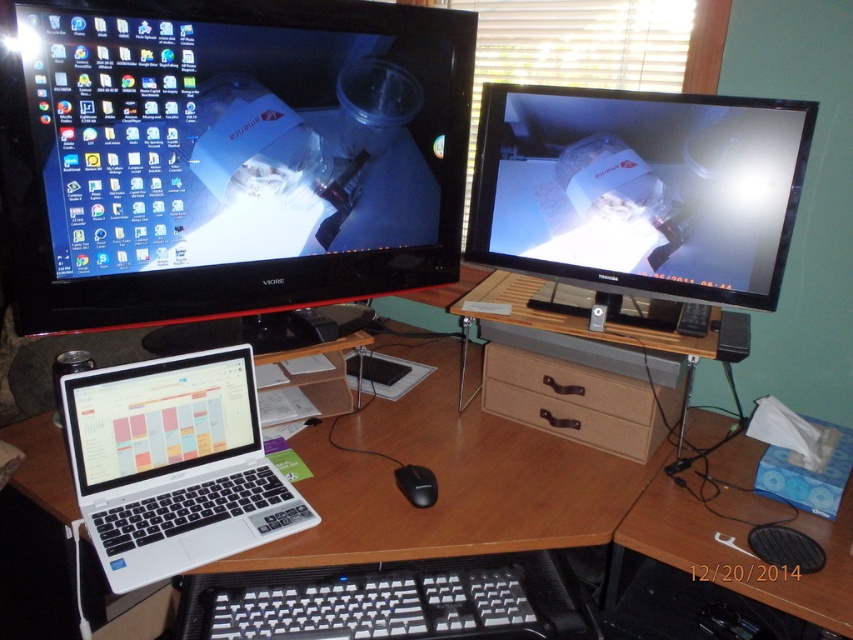
You are looking at a desk with two points marked on it. The first point is at coordinates point [155,461] and the second is at point [515,353]. Which of these points is closer to you?

Point [155,461] is closer to the viewer than point [515,353].

You are organizing your desk and need to move the white plastic laptop at lower left closer to the satin black monitor at upper right. Which direction should you move the laptop to get it closer?

To move the white plastic laptop at lower left closer to the satin black monitor at upper right, you should move it upward since the satin black monitor at upper right is located above the white plastic laptop at lower left.

You are organizing your desk and want to place a new item between the matte black monitor at upper left and the brown leather drawer at lower center. Considering their sizes, which object should you place closer to the edge of the desk to ensure stability?

The brown leather drawer at lower center is smaller in size compared to the matte black monitor at upper left. To ensure stability, place the smaller brown leather drawer at lower center closer to the edge of the desk since it has a lower center of gravity and is less likely to tip over.